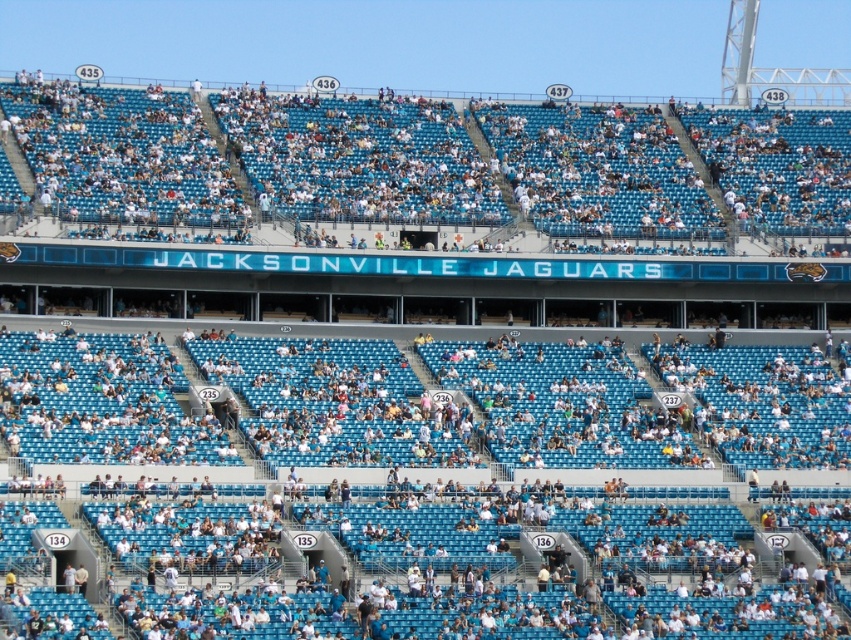
You are a spectator at the Jacksonville Jaguars game and you see two sections of seats at the center of the stadium. Which one is more to the left side? The white plastic seats at center or the light blue seats at center?

The white plastic seats at center is positioned on the left side of light blue seats at center, so the white plastic seats at center are more to the left side.

You are a spectator sitting in the light blue seats at center. You want to move to the row behind you to get a better view. Is the row behind you occupied by white plastic seats at center?

The white plastic seats at center is in front of light blue seats at center, so the row behind the light blue seats at center would not be the white plastic seats at center since they are in front. Therefore, the row behind you is not occupied by white plastic seats at center.